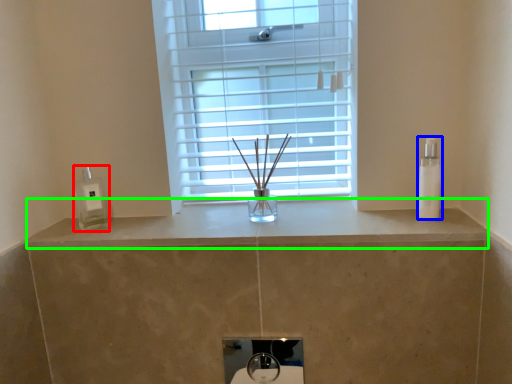
Question: Considering the real-world distances, which object is closest to soap dispenser (highlighted by a red box)? toiletry (highlighted by a blue box) or counter top (highlighted by a green box).

Choices:
 (A) toiletry
 (B) counter top

Answer: (B)